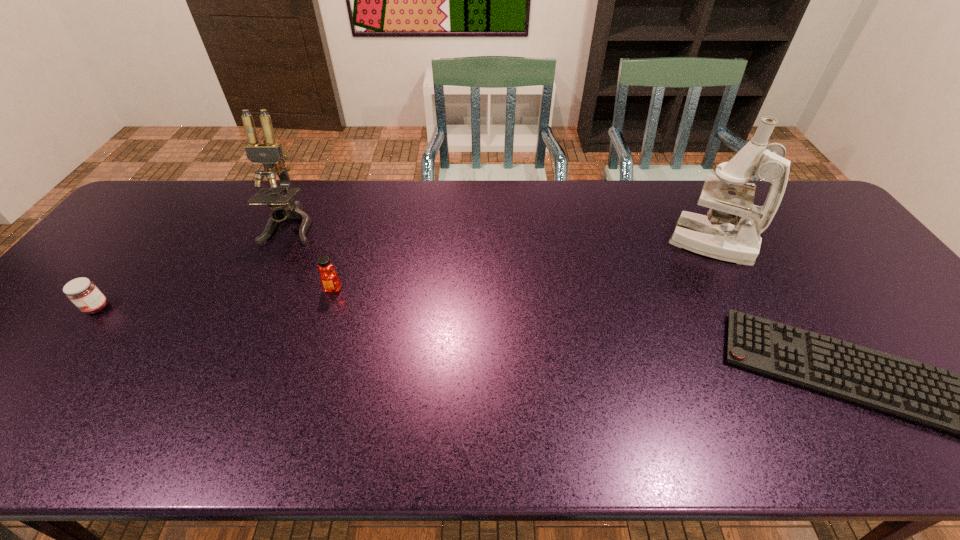
The image size is (960, 540). Find the location of `object that ranks as the third closest to the computer keyboard`. object that ranks as the third closest to the computer keyboard is located at coordinates (269, 153).

I want to click on object that stands as the closest to the third object from left to right, so 269,153.

Locate an element on the screen. free region that satisfies the following two spatial constraints: 1. at the eyepieces of the left microscope; 2. on the right side of the right microscope is located at coordinates (282, 242).

Where is `free location that satisfies the following two spatial constraints: 1. on the back side of the leftmost object; 2. on the right side of the right microscope`? This screenshot has height=540, width=960. free location that satisfies the following two spatial constraints: 1. on the back side of the leftmost object; 2. on the right side of the right microscope is located at coordinates (148, 242).